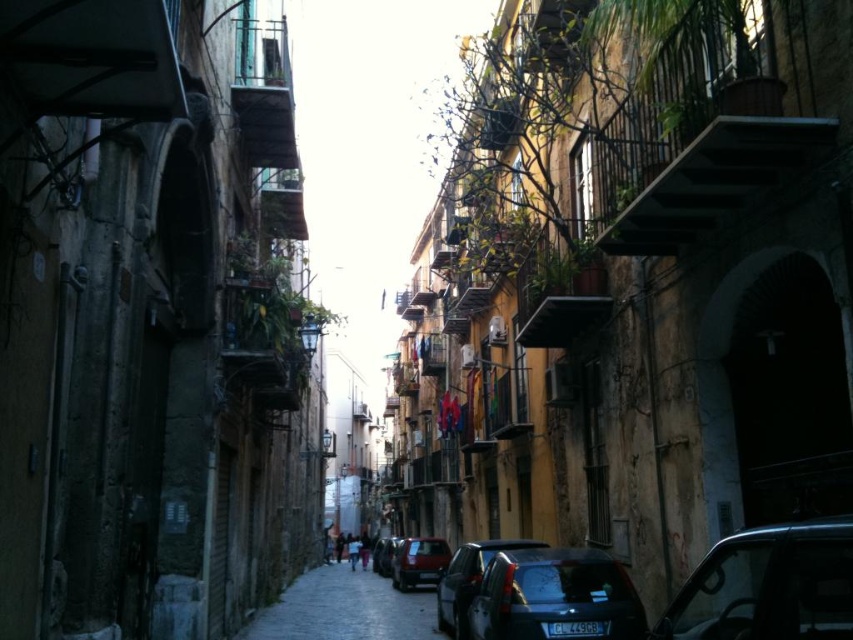
Consider the image. You are a delivery person needing to park your 3.5 meter long van in this alley. You see the matte red car at center and the shiny black car at center. Which car is longer and can you fit your van between them?

The shiny black car at center is longer than the matte red car at center. Since the shiny black car at center is longer, the space between them may not be sufficient for a 3.5 meter van. You should check the exact distance between the cars to ensure there is enough space.

You are driving a car that is 15 feet long and want to park in the space where the matte red car at center is currently parked. Can you safely fit your car into that space?

The distance between the matte red car at center and the camera is 72.70 feet. Since your car is only 15 feet long, there is ample space to park safely.